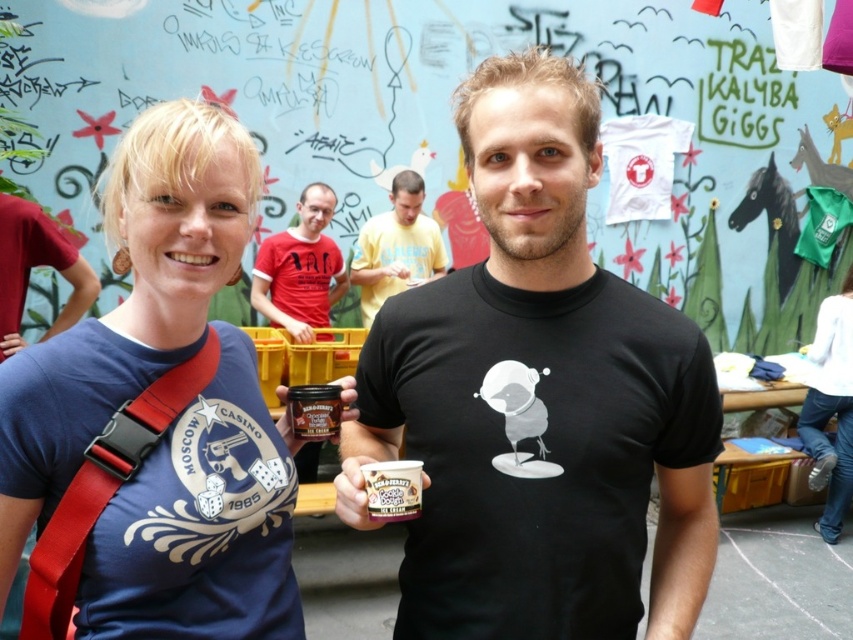
Does point (303, 266) lie in front of point (323, 396)?

No, it is behind (323, 396).

Between matte red t-shirt at center and chocolate brown jar at center, which one has less height?

chocolate brown jar at center is shorter.

In the scene shown: Measure the distance between matte red t-shirt at center and camera.

matte red t-shirt at center and camera are 3.87 meters apart.

Identify the location of matte red t-shirt at center. This screenshot has width=853, height=640. (300, 268).

Does matte red t-shirt at center appear under smooth chocolate ice cream at center?

Incorrect, matte red t-shirt at center is not positioned below smooth chocolate ice cream at center.

Between point (267, 268) and point (407, 515), which one is positioned in front?

Positioned in front is point (407, 515).

Is point (287, 234) more distant than point (407, 499)?

Yes, it is.

The height and width of the screenshot is (640, 853). Find the location of `matte red t-shirt at center`. matte red t-shirt at center is located at coordinates (300, 268).

Does yellow t-shirt at center appear under chocolate brown jar at center?

No, yellow t-shirt at center is not below chocolate brown jar at center.

At what (x,y) coordinates should I click in order to perform the action: click on yellow t-shirt at center. Please return your answer as a coordinate pair (x, y). This screenshot has width=853, height=640. Looking at the image, I should click on (396, 248).